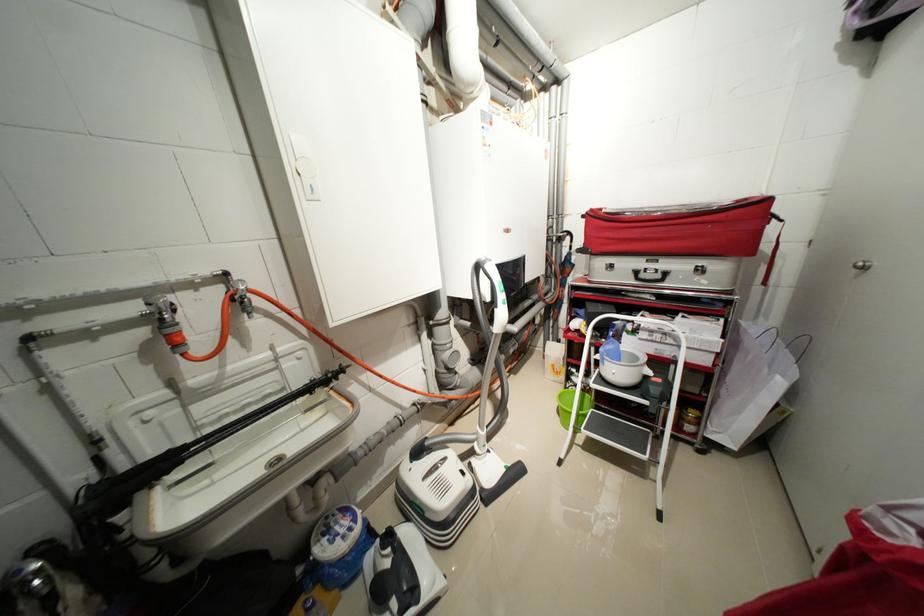
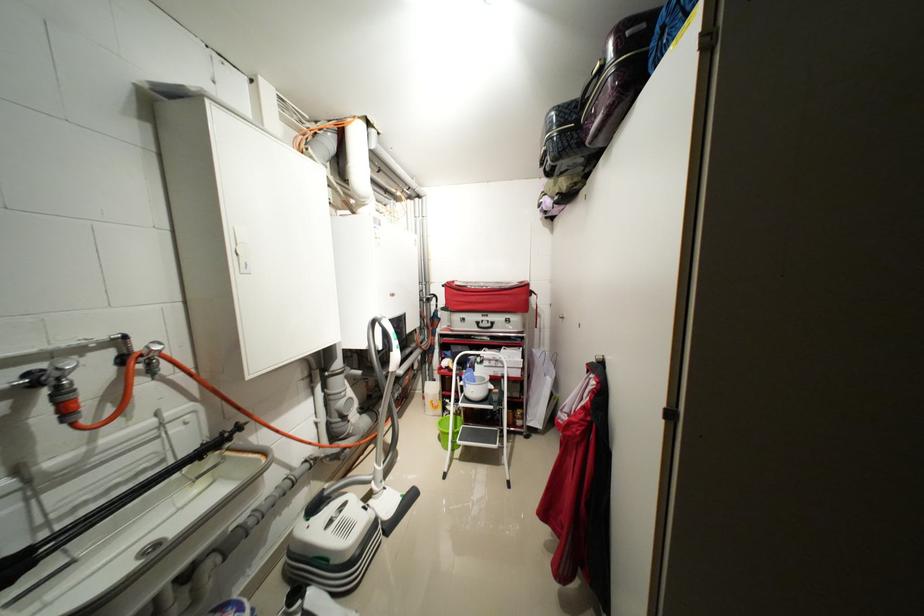
Find the pixel in the second image that matches the point at 317,198 in the first image.

(250, 272)